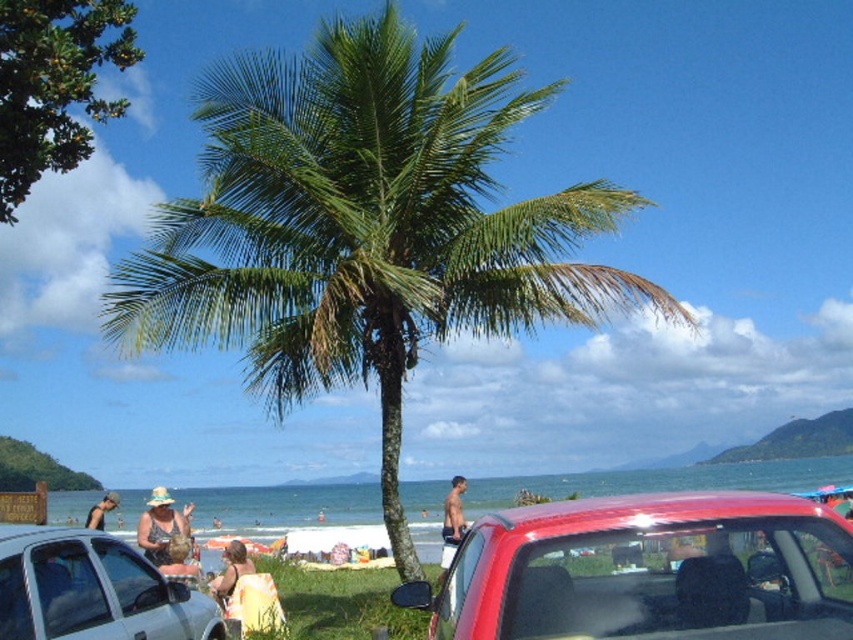
You are standing at the beach and want to take a photo of the green leafy palm tree at center. If your camera can focus on objects up to 10 meters away, will you be able to capture a clear image of the tree?

The green leafy palm tree at center is 8.53 meters from viewer, so yes, the camera can focus on it since the distance is within the 10 meters range.

You are standing on the beach and want to take a photo of the shiny red car at center. If your camera has a maximum focus range of 3 meters, will you be able to capture a clear photo?

The distance between you and the shiny red car at center is exactly 3.00 meters, so yes, your camera can focus on it clearly since it is within the 3 meter range.